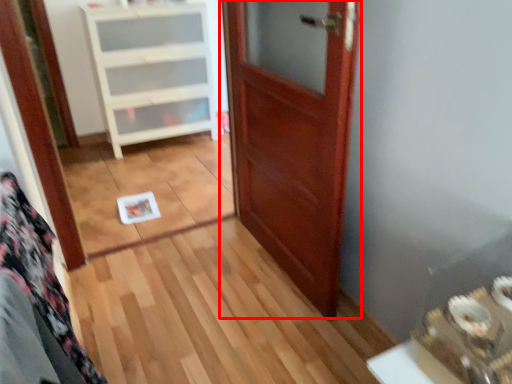
Question: From the image's perspective, what is the correct spatial positioning of door (annotated by the red box) in reference to cabinetry?

Choices:
 (A) above
 (B) below

Answer: (B)